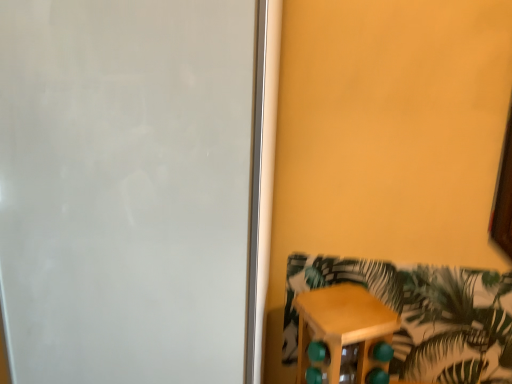
Question: Does white matte screen door at left have a lesser width compared to wooden stool at lower right?

Choices:
 (A) no
 (B) yes

Answer: (A)

Question: Can you confirm if white matte screen door at left is positioned to the right of wooden stool at lower right?

Choices:
 (A) no
 (B) yes

Answer: (A)

Question: Can you confirm if white matte screen door at left is wider than wooden stool at lower right?

Choices:
 (A) yes
 (B) no

Answer: (A)

Question: From a real-world perspective, is white matte screen door at left on wooden stool at lower right?

Choices:
 (A) no
 (B) yes

Answer: (B)

Question: Would you say wooden stool at lower right is part of white matte screen door at left's contents?

Choices:
 (A) no
 (B) yes

Answer: (A)

Question: Is there a large distance between white matte screen door at left and wooden stool at lower right?

Choices:
 (A) yes
 (B) no

Answer: (B)

Question: Is wooden stool at lower right located outside white matte screen door at left?

Choices:
 (A) yes
 (B) no

Answer: (A)

Question: Does wooden stool at lower right have a smaller size compared to white matte screen door at left?

Choices:
 (A) yes
 (B) no

Answer: (A)

Question: Can you confirm if wooden stool at lower right is wider than white matte screen door at left?

Choices:
 (A) yes
 (B) no

Answer: (B)

Question: From the image's perspective, does wooden stool at lower right appear higher than white matte screen door at left?

Choices:
 (A) yes
 (B) no

Answer: (B)

Question: Is wooden stool at lower right positioned with its back to white matte screen door at left?

Choices:
 (A) no
 (B) yes

Answer: (A)

Question: Considering the relative positions of wooden stool at lower right and white matte screen door at left in the image provided, is wooden stool at lower right in front of white matte screen door at left?

Choices:
 (A) yes
 (B) no

Answer: (B)

Question: Considering the positions of point (379, 352) and point (220, 135), is point (379, 352) closer or farther from the camera than point (220, 135)?

Choices:
 (A) farther
 (B) closer

Answer: (A)